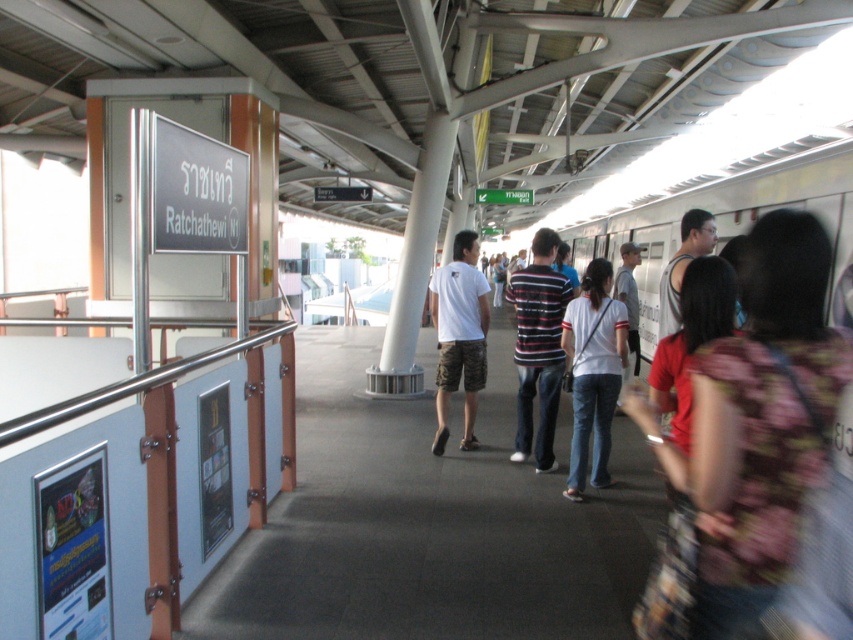
Question: Which point is farther to the camera?

Choices:
 (A) (773, 346)
 (B) (553, 275)

Answer: (B)

Question: Is white cotton shirt at center behind white cotton t-shirt at center?

Choices:
 (A) no
 (B) yes

Answer: (A)

Question: Is the position of floral fabric dress at center more distant than that of white cotton shirt at center?

Choices:
 (A) no
 (B) yes

Answer: (A)

Question: Which object is farther from the camera taking this photo?

Choices:
 (A) white cotton t-shirt at center
 (B) white cotton shirt at center
 (C) striped cotton shirt at center
 (D) floral fabric dress at center

Answer: (A)

Question: In this image, where is floral fabric dress at center located relative to white cotton shirt at center?

Choices:
 (A) right
 (B) left

Answer: (B)

Question: Which point is closer to the camera?

Choices:
 (A) white cotton t-shirt at center
 (B) floral fabric dress at center

Answer: (B)